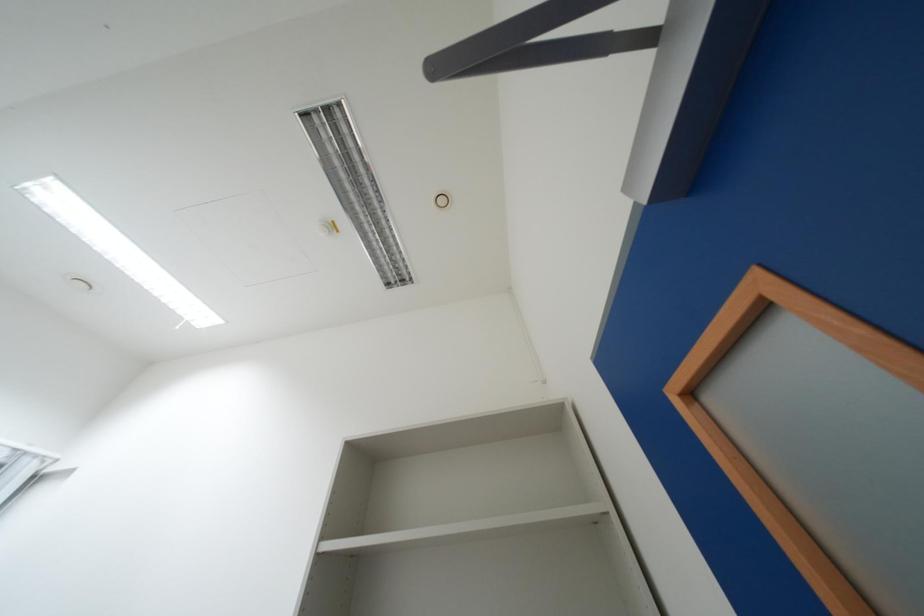
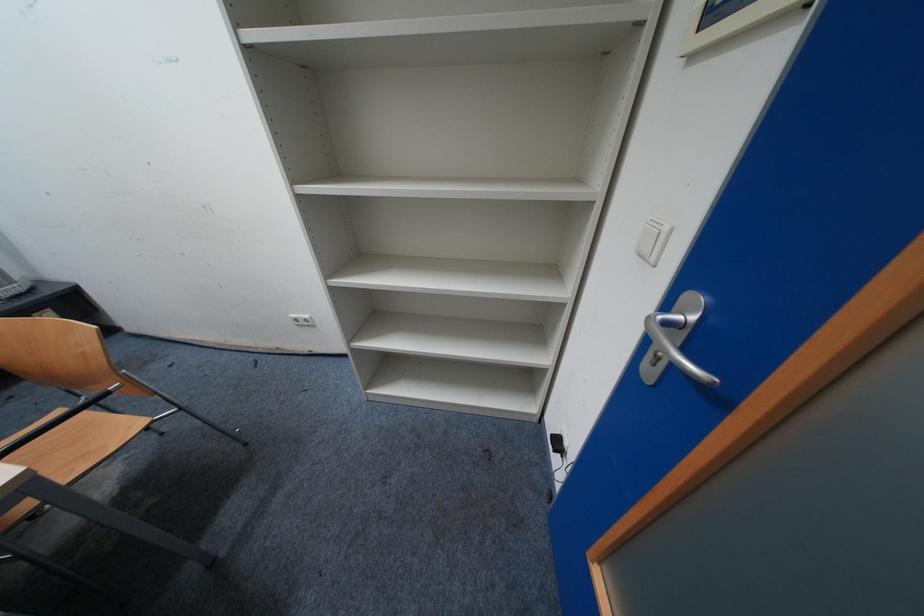
In the scene shown: How did the camera likely rotate?

The camera's rotation is toward right-down.